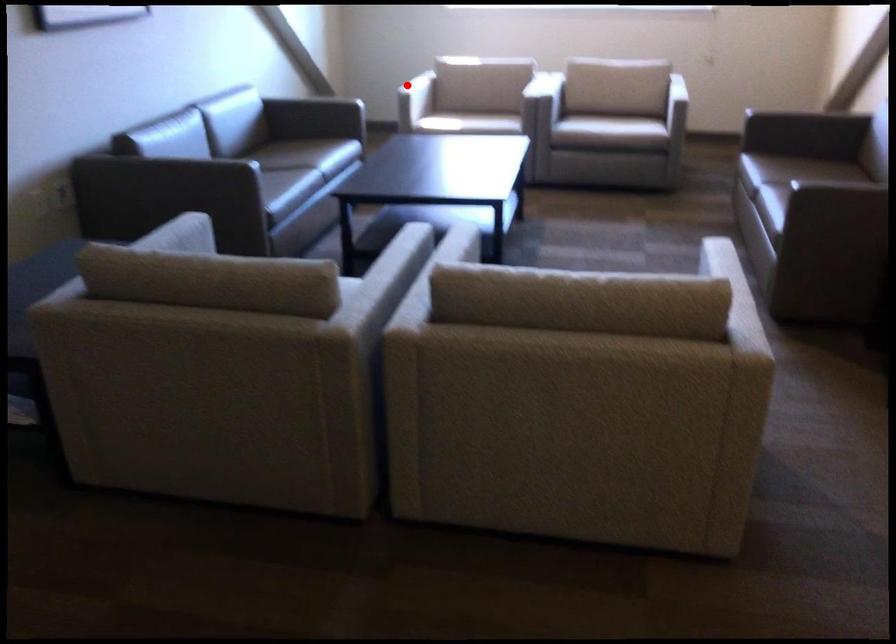
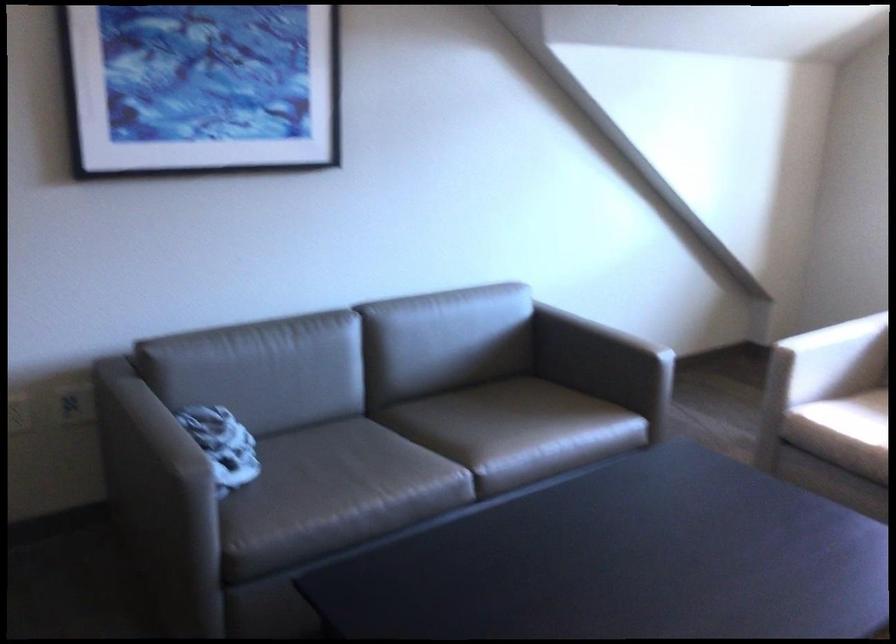
Question: A red point is marked in image1. In image2, is the corresponding 3D point closer to the camera or farther? Reply with the corresponding letter.

Choices:
 (A) The corresponding 3D point is closer.
 (B) The corresponding 3D point is farther.

Answer: (A)